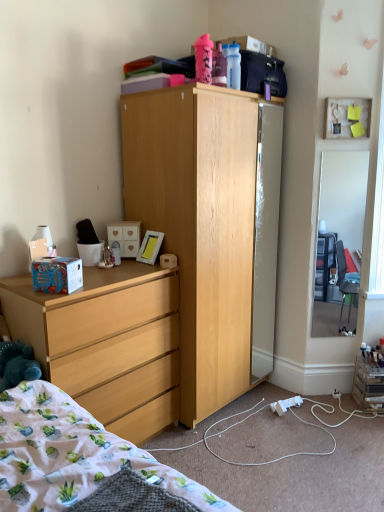
Measure the distance between mirror glass refrigerator at center and camera.

mirror glass refrigerator at center and camera are 9.03 feet apart.

In order to face matte white picture frame at upper right, should I rotate leftwards or rightwards?

To face it directly, rotate right by 20.086 degrees.

Describe the element at coordinates (107, 343) in the screenshot. I see `matte wood dresser at lower left` at that location.

Find the location of a particular element. The width and height of the screenshot is (384, 512). clear glass mirror at right is located at coordinates (338, 237).

From the picture: In order to face white plastic power outlet at lower center, should I rotate leftwards or rightwards?

Turn right by 12.424 degrees to look at white plastic power outlet at lower center.

Describe the element at coordinates (211, 227) in the screenshot. I see `light wood cabinet at center` at that location.

What are the coordinates of `white matte drawer at center` in the screenshot? It's located at (125, 237).

What is the approximate height of white matte drawer at center?

22.97 centimeters.

The height and width of the screenshot is (512, 384). Identify the location of mirror glass refrigerator at center. (266, 237).

Which object is closer to the camera, blue cardboard box at left or matte white picture frame at upper right?

blue cardboard box at left is more forward.

Which of these two, blue cardboard box at left or matte white picture frame at upper right, is thinner?

Thinner between the two is matte white picture frame at upper right.

Is blue cardboard box at left facing away from matte white picture frame at upper right?

No, blue cardboard box at left's orientation is not away from matte white picture frame at upper right.

Would you say blue cardboard box at left contains matte white picture frame at upper right?

No, blue cardboard box at left does not contain matte white picture frame at upper right.

Considering the positions of objects light wood cabinet at center and blue cardboard box at left in the image provided, who is in front, light wood cabinet at center or blue cardboard box at left?

blue cardboard box at left.

Consider the image. Does light wood cabinet at center have a larger size compared to blue cardboard box at left?

Correct, light wood cabinet at center is larger in size than blue cardboard box at left.

Would you say light wood cabinet at center is to the left or to the right of blue cardboard box at left in the picture?

light wood cabinet at center is positioned on blue cardboard box at left's right side.

From the image's perspective, does light wood cabinet at center appear lower than blue cardboard box at left?

No, from the image's perspective, light wood cabinet at center is not below blue cardboard box at left.

Considering the relative sizes of light wood cabinet at center and matte wood dresser at lower left in the image provided, is light wood cabinet at center wider than matte wood dresser at lower left?

Yes, light wood cabinet at center is wider than matte wood dresser at lower left.

Can you confirm if light wood cabinet at center is smaller than matte wood dresser at lower left?

Actually, light wood cabinet at center might be larger than matte wood dresser at lower left.

Is light wood cabinet at center positioned beyond the bounds of matte wood dresser at lower left?

That's correct, light wood cabinet at center is outside of matte wood dresser at lower left.

Considering the sizes of objects fluffy cotton blanket at lower left and matte white picture frame at upper right in the image provided, who is thinner, fluffy cotton blanket at lower left or matte white picture frame at upper right?

matte white picture frame at upper right.

Could you tell me if fluffy cotton blanket at lower left is turned towards matte white picture frame at upper right?

No, fluffy cotton blanket at lower left does not turn towards matte white picture frame at upper right.

In the scene shown: Is the depth of fluffy cotton blanket at lower left greater than that of matte white picture frame at upper right?

No, it is in front of matte white picture frame at upper right.

From the picture: What's the angular difference between fluffy cotton blanket at lower left and matte white picture frame at upper right's facing directions?

The facing directions of fluffy cotton blanket at lower left and matte white picture frame at upper right are 133 degrees apart.

Is light wood cabinet at center wider than white matte drawer at center?

Correct, the width of light wood cabinet at center exceeds that of white matte drawer at center.

From a real-world perspective, who is located lower, light wood cabinet at center or white matte drawer at center?

light wood cabinet at center is physically lower.

Can you confirm if light wood cabinet at center is smaller than white matte drawer at center?

No.

Considering the positions of point (189, 355) and point (133, 238), is point (189, 355) closer or farther from the camera than point (133, 238)?

Point (189, 355) appears to be closer to the viewer than point (133, 238).

Is clear glass mirror at right facing away from light wood cabinet at center?

No, clear glass mirror at right is not facing the opposite direction of light wood cabinet at center.

This screenshot has height=512, width=384. Identify the location of cabinetry located on the left of clear glass mirror at right. (211, 227).

From the picture: Does clear glass mirror at right appear on the left side of light wood cabinet at center?

In fact, clear glass mirror at right is to the right of light wood cabinet at center.

Could fluffy cotton blanket at lower left be considered to be inside matte white picture frame at upper right?

No.

At what (x,y) coordinates should I click in order to perform the action: click on bed that is in front of the matte white picture frame at upper right. Please return your answer as a coordinate pair (x, y). Looking at the image, I should click on (72, 455).

Is matte white picture frame at upper right next to fluffy cotton blanket at lower left?

No, matte white picture frame at upper right is not with fluffy cotton blanket at lower left.

Who is shorter, matte white picture frame at upper right or fluffy cotton blanket at lower left?

With less height is fluffy cotton blanket at lower left.

This screenshot has height=512, width=384. Find the location of `box below the matte white picture frame at upper right (from the image's perspective)`. box below the matte white picture frame at upper right (from the image's perspective) is located at coordinates (57, 275).

At what (x,y) coordinates should I click in order to perform the action: click on box that appears on the left of light wood cabinet at center. Please return your answer as a coordinate pair (x, y). Looking at the image, I should click on (57, 275).

Estimate the real-world distances between objects in this image. Which object is further from mirror glass refrigerator at center, velvety blue teddy bear at lower left or matte white picture frame at upper right?

velvety blue teddy bear at lower left is positioned further to the anchor mirror glass refrigerator at center.

Estimate the real-world distances between objects in this image. Which object is closer to mirror glass refrigerator at center, clear glass mirror at right or white plastic power outlet at lower center?

Based on the image, white plastic power outlet at lower center appears to be nearer to mirror glass refrigerator at center.

From the image, which object appears to be nearer to white plastic power outlet at lower center, matte white picture frame at upper right or blue cardboard box at left?

blue cardboard box at left lies closer to white plastic power outlet at lower center than the other object.

Consider the image. Looking at the image, which one is located further to matte wood dresser at lower left, velvety blue teddy bear at lower left or matte white picture frame at upper right?

Based on the image, matte white picture frame at upper right appears to be further to matte wood dresser at lower left.

Based on their spatial positions, is fluffy cotton blanket at lower left or matte white picture frame at upper right closer to velvety blue teddy bear at lower left?

fluffy cotton blanket at lower left is closer to velvety blue teddy bear at lower left.

Based on their spatial positions, is clear glass mirror at right or white matte drawer at center closer to matte wood dresser at lower left?

white matte drawer at center is positioned closer to the anchor matte wood dresser at lower left.

In the scene shown: Estimate the real-world distances between objects in this image. Which object is closer to light wood cabinet at center, velvety blue teddy bear at lower left or white matte drawer at center?

The object closer to light wood cabinet at center is white matte drawer at center.

From the image, which object appears to be farther from white plastic power outlet at lower center, blue cardboard box at left or light wood cabinet at center?

blue cardboard box at left lies further to white plastic power outlet at lower center than the other object.

Find the location of `desk between velvety blue teddy bear at lower left and matte white picture frame at upper right in the horizontal direction`. desk between velvety blue teddy bear at lower left and matte white picture frame at upper right in the horizontal direction is located at coordinates (107, 343).

This screenshot has width=384, height=512. Find the location of `drawer located between matte wood dresser at lower left and matte white picture frame at upper right in the left-right direction`. drawer located between matte wood dresser at lower left and matte white picture frame at upper right in the left-right direction is located at coordinates (125, 237).

The width and height of the screenshot is (384, 512). Find the location of `box between velvety blue teddy bear at lower left and clear glass mirror at right from left to right`. box between velvety blue teddy bear at lower left and clear glass mirror at right from left to right is located at coordinates (57, 275).

Find the location of a particular element. The image size is (384, 512). power outlet between matte white picture frame at upper right and fluffy cotton blanket at lower left in the vertical direction is located at coordinates (285, 405).